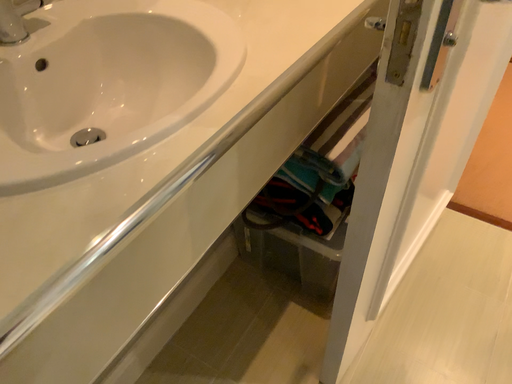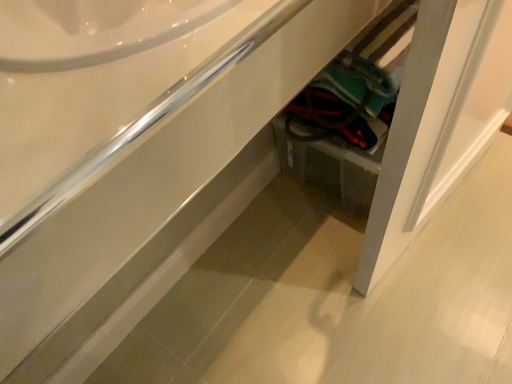
Question: How did the camera likely rotate when shooting the video?

Choices:
 (A) rotated left
 (B) rotated right

Answer: (A)